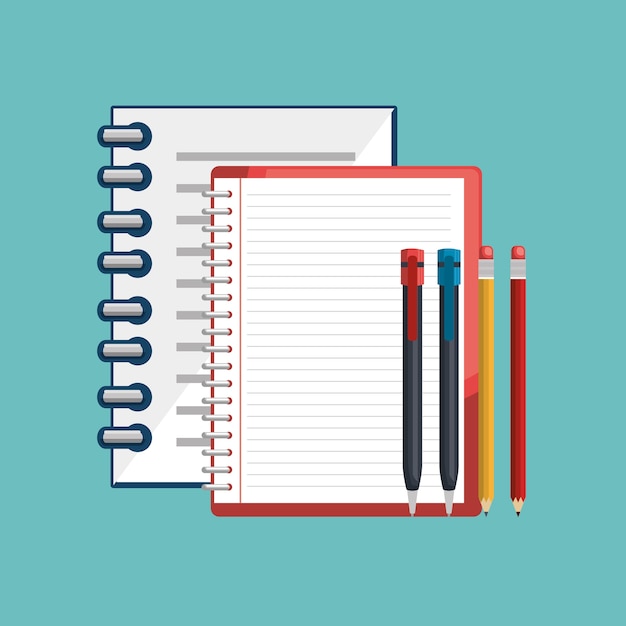
The image size is (626, 626). I want to click on pen, so click(x=413, y=356), click(x=449, y=402).